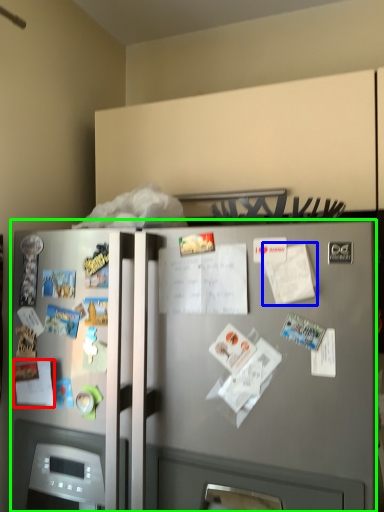
Question: Considering the real-world distances, which object is closest to paper (highlighted by a red box)? paper (highlighted by a blue box) or refrigerator (highlighted by a green box).

Choices:
 (A) paper
 (B) refrigerator

Answer: (B)